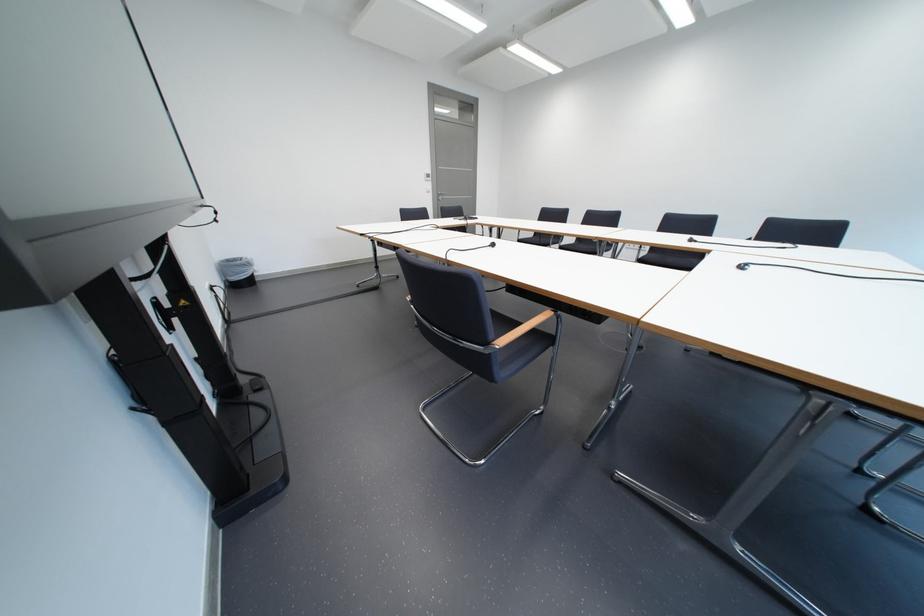
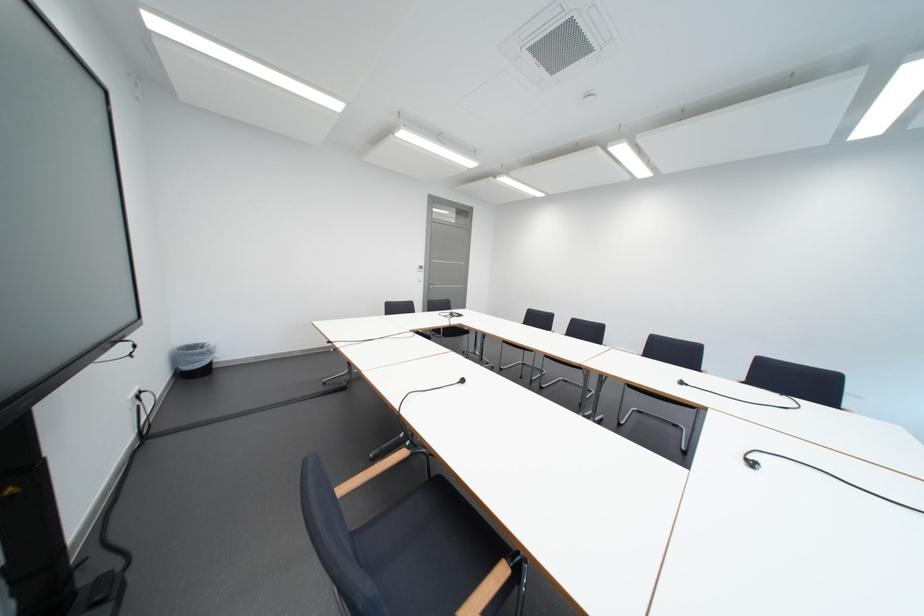
In a continuous first-person perspective shot, in which direction is the camera moving?

The movement direction of the cameraman is right, forward.